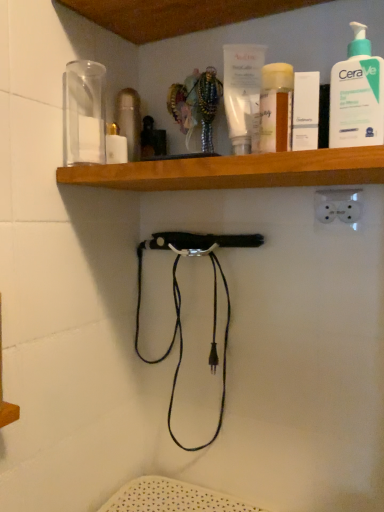
Find the location of a particular element. wooden at upper center is located at coordinates click(236, 170).

You are a GUI agent. You are given a task and a screenshot of the screen. Output one action in this format:
    pyautogui.click(x=<x>, y=<y>)
    Task: Click on the wooden at upper center
    
    Given the screenshot: What is the action you would take?
    pyautogui.click(x=236, y=170)

From their relative heights in the image, would you say white pump bottle at upper right is taller or shorter than wooden at upper center?

Clearly, white pump bottle at upper right is taller compared to wooden at upper center.

From a real-world perspective, between white pump bottle at upper right and wooden at upper center, who is vertically higher?

white pump bottle at upper right.

From the image's perspective, which is above, white pump bottle at upper right or wooden at upper center?

white pump bottle at upper right.

Visually, is wooden at upper center positioned to the left or to the right of white matte box at upper center?

Based on their positions, wooden at upper center is located to the left of white matte box at upper center.

From the image's perspective, is wooden at upper center under white matte box at upper center?

Yes, from the image's perspective, wooden at upper center is below white matte box at upper center.

Does wooden at upper center contain white matte box at upper center?

Definitely not — white matte box at upper center is not inside wooden at upper center.

Considering the relative sizes of wooden at upper center and white matte box at upper center in the image provided, is wooden at upper center smaller than white matte box at upper center?

No, wooden at upper center is not smaller than white matte box at upper center.

Are white matte box at upper center and white pump bottle at upper right far apart?

That's not correct — white matte box at upper center is a little close to white pump bottle at upper right.

Considering their positions, is white matte box at upper center located in front of or behind white pump bottle at upper right?

white matte box at upper center is behind white pump bottle at upper right.

From the image's perspective, relative to white pump bottle at upper right, is white matte box at upper center above or below?

Clearly, from the image's perspective, white matte box at upper center is below white pump bottle at upper right.

You are a GUI agent. You are given a task and a screenshot of the screen. Output one action in this format:
    pyautogui.click(x=<x>, y=<y>)
    Task: Click on the cleaning product that appears in front of the white matte box at upper center
    The image size is (384, 512).
    Given the screenshot: What is the action you would take?
    pyautogui.click(x=357, y=95)

Considering the positions of objects white pump bottle at upper right and white matte box at upper center in the image provided, who is more to the left, white pump bottle at upper right or white matte box at upper center?

white matte box at upper center is more to the left.

From a real-world perspective, is white pump bottle at upper right physically above white matte box at upper center?

Yes.

Is white pump bottle at upper right not close to white matte box at upper center?

No.

Is wooden at upper center oriented towards white pump bottle at upper right?

No.

Is wooden at upper center with white pump bottle at upper right?

There is a gap between wooden at upper center and white pump bottle at upper right.

Which of these two, wooden at upper center or white pump bottle at upper right, is wider?

wooden at upper center.

Where is `cleaning product that appears above the wooden at upper center (from a real-world perspective)`? cleaning product that appears above the wooden at upper center (from a real-world perspective) is located at coordinates (357, 95).

From the image's perspective, relative to wooden at upper center, is white matte box at upper center above or below?

white matte box at upper center is situated higher than wooden at upper center in the image.

Which of these two, white matte box at upper center or wooden at upper center, is wider?

With larger width is wooden at upper center.

Which point is more distant from viewer, [318,102] or [353,170]?

Point [318,102]

I want to click on shelf below the white pump bottle at upper right (from the image's perspective), so click(236, 170).

Where is `shelf located in front of the white matte box at upper center`? shelf located in front of the white matte box at upper center is located at coordinates (236, 170).

Looking at the image, which one is located further to wooden at upper center, white pump bottle at upper right or white matte box at upper center?

Among the two, white pump bottle at upper right is located further to wooden at upper center.

When comparing their distances from white matte box at upper center, does wooden at upper center or white pump bottle at upper right seem further?

Among the two, wooden at upper center is located further to white matte box at upper center.

Based on their spatial positions, is wooden at upper center or white matte box at upper center further from white pump bottle at upper right?

wooden at upper center is further to white pump bottle at upper right.

When comparing their distances from white matte box at upper center, does white pump bottle at upper right or wooden at upper center seem closer?

white pump bottle at upper right is positioned closer to the anchor white matte box at upper center.

Considering their positions, is white matte box at upper center positioned closer to white pump bottle at upper right than wooden at upper center?

white matte box at upper center.

From the picture: From the image, which object appears to be farther from wooden at upper center, white matte box at upper center or white pump bottle at upper right?

white pump bottle at upper right is further to wooden at upper center.

You are a GUI agent. You are given a task and a screenshot of the screen. Output one action in this format:
    pyautogui.click(x=<x>, y=<y>)
    Task: Click on the toiletry between wooden at upper center and white pump bottle at upper right in the horizontal direction
    The width and height of the screenshot is (384, 512).
    Given the screenshot: What is the action you would take?
    pyautogui.click(x=305, y=111)